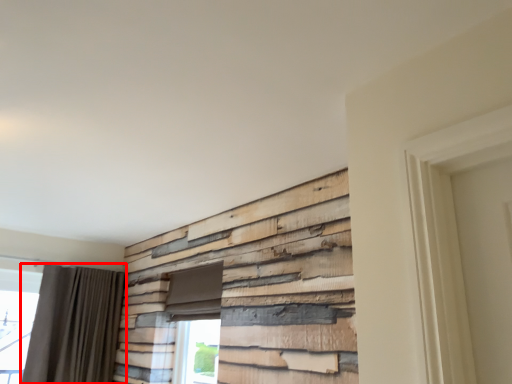
Question: From the image's perspective, considering the relative positions of curtain (annotated by the red box) and window in the image provided, where is curtain (annotated by the red box) located with respect to the staircase?

Choices:
 (A) above
 (B) below

Answer: (A)